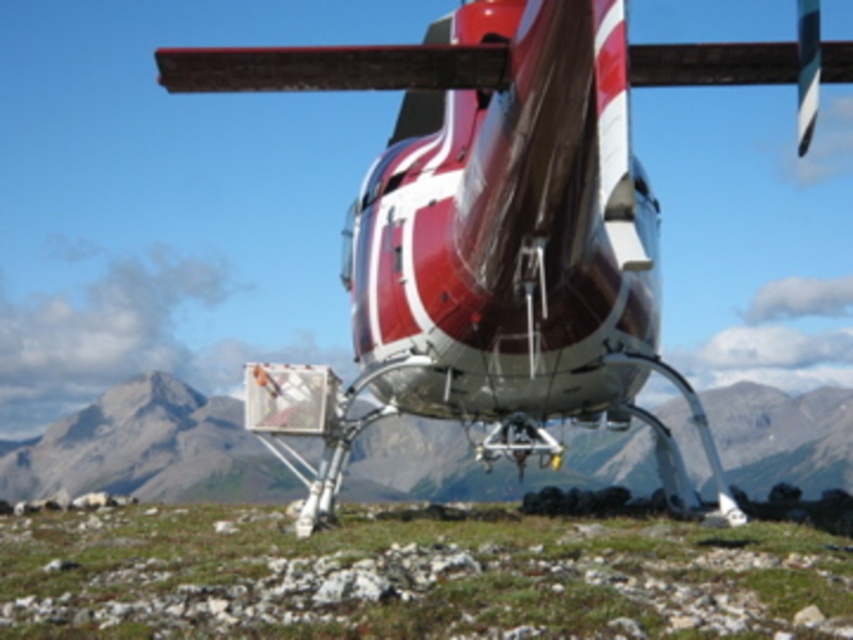
Question: Which object is the farthest from the green grass at center?

Choices:
 (A) matte gray rock at center
 (B) shiny metallic helicopter at center

Answer: (A)

Question: Is shiny metallic helicopter at center to the right of green grass at center from the viewer's perspective?

Choices:
 (A) no
 (B) yes

Answer: (A)

Question: Observing the image, what is the correct spatial positioning of shiny metallic helicopter at center in reference to matte gray rock at center?

Choices:
 (A) below
 (B) above

Answer: (B)

Question: Which object appears closest to the camera in this image?

Choices:
 (A) matte gray rock at center
 (B) shiny metallic helicopter at center

Answer: (B)

Question: Can you confirm if green grass at center is positioned to the right of matte gray rock at center?

Choices:
 (A) no
 (B) yes

Answer: (B)

Question: Based on their relative distances, which object is nearer to the green grass at center?

Choices:
 (A) shiny metallic helicopter at center
 (B) matte gray rock at center

Answer: (A)